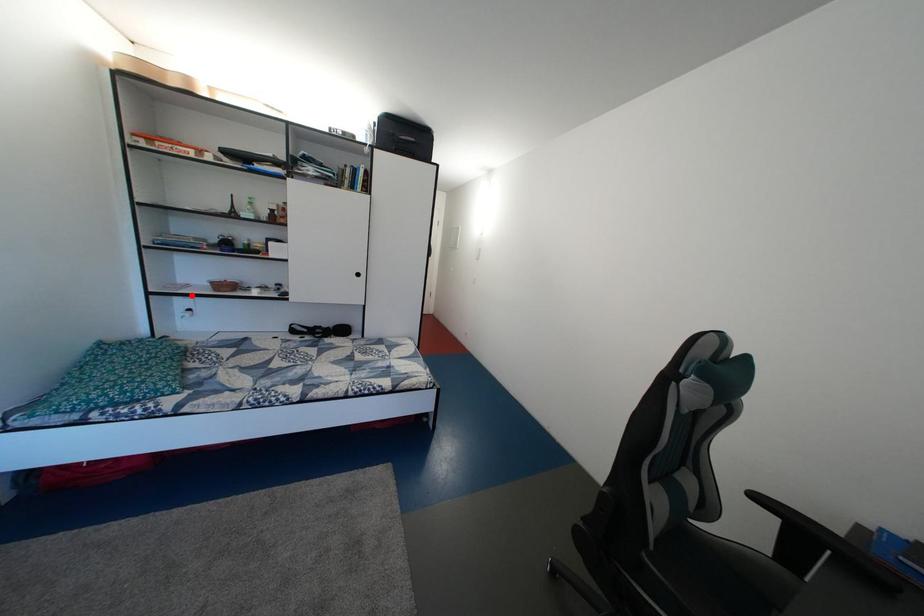
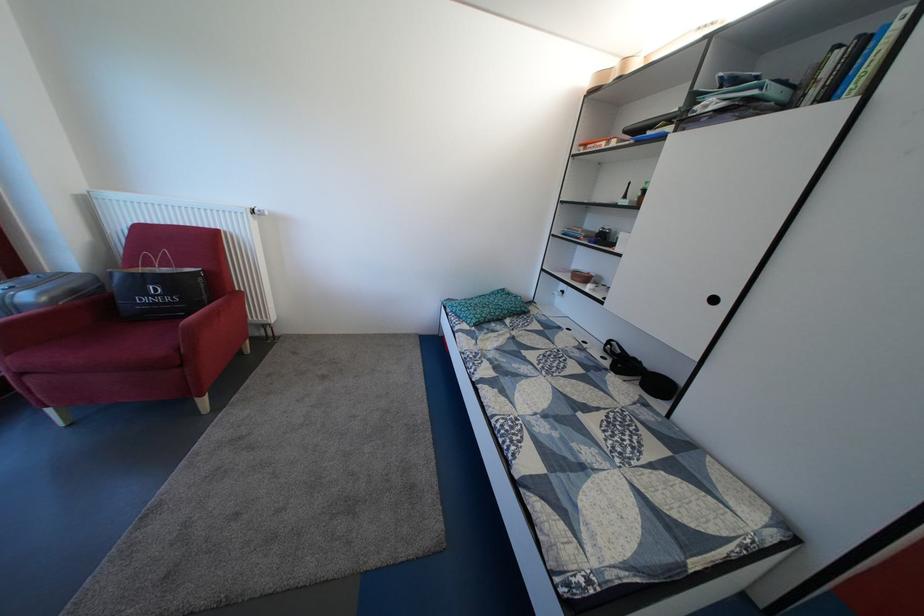
The point at the highlighted location is marked in the first image. Where is the corresponding point in the second image?

(570, 278)